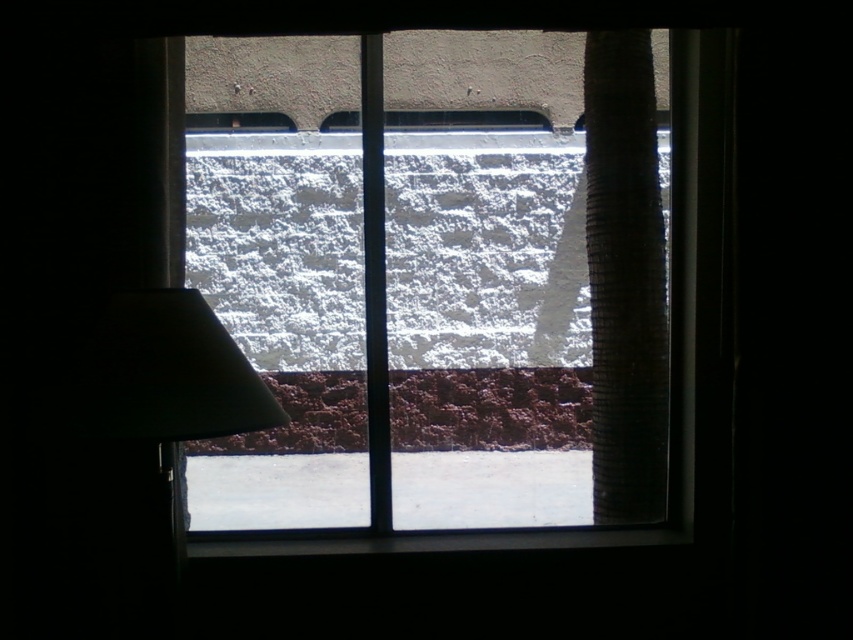
Question: Which point appears closest to the camera in this image?

Choices:
 (A) (531, 476)
 (B) (631, 56)
 (C) (315, 209)

Answer: (B)

Question: Which point is farther to the camera?

Choices:
 (A) (532, 157)
 (B) (495, 230)
 (C) (630, 451)

Answer: (B)

Question: Is transparent glass window at center positioned behind black corrugated pipe at right?

Choices:
 (A) no
 (B) yes

Answer: (B)

Question: Does transparent glass window at center come in front of black corrugated pipe at right?

Choices:
 (A) yes
 (B) no

Answer: (B)

Question: Does transparent glass window at center appear on the right side of white powdery snow at center?

Choices:
 (A) no
 (B) yes

Answer: (B)

Question: Which object is farther from the camera taking this photo?

Choices:
 (A) black corrugated pipe at right
 (B) white powdery snow at center
 (C) transparent glass window at center

Answer: (B)